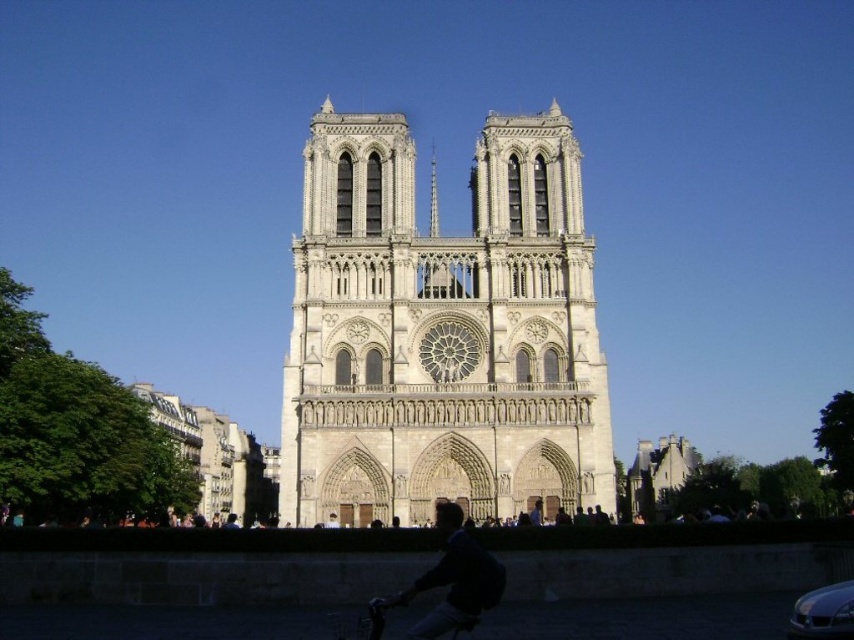
In the scene shown: You are a photographer standing in front of the Notre Dame Cathedral. You want to take a photo that includes both the dark blue sweater at lower center and the smooth stone spire at center. Which object should you zoom in on to ensure both are clearly visible in the frame?

You should zoom in on the dark blue sweater at lower center because its width is greater than the smooth stone spire at center, allowing it to be captured more clearly when zoomed in.

You are a tour guide leading a group near the beige stone cathedral at center and the smooth stone spire at center. You want to place a 100 feet long banner between them to highlight their historical significance. Will the banner be long enough to stretch between the two landmarks?

The beige stone cathedral at center and smooth stone spire at center are 77.91 feet apart from each other. Since the banner is 100 feet long, it will be long enough to stretch between them with extra length remaining.

You are a photographer planning to take a wide shot of the beige stone cathedral at center and the smooth stone spire at center. Given that the cathedral is wider than the spire, how should you position your camera to ensure both are fully captured in the frame?

Since the beige stone cathedral at center is wider than the smooth stone spire at center, you should position your camera closer to the cathedral to accommodate its greater width while still capturing the spire in the frame.